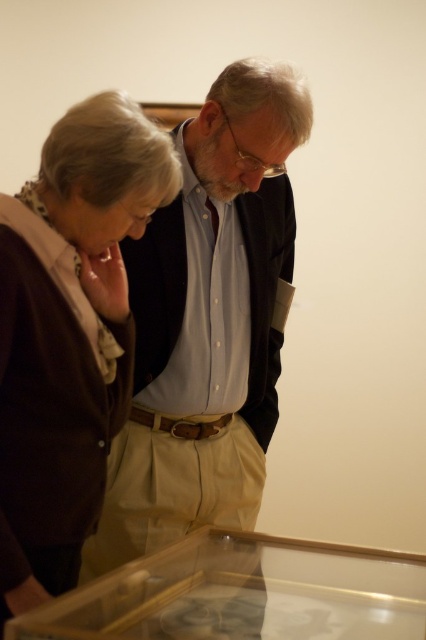
Which is behind, point (178, 497) or point (97, 145)?

Point (178, 497)

Where is `light blue button-down shirt at center`? This screenshot has height=640, width=426. light blue button-down shirt at center is located at coordinates (207, 323).

Does point (192, 420) come in front of point (63, 296)?

No.

What are the coordinates of `light blue button-down shirt at center` in the screenshot? It's located at (207, 323).

Does light blue button-down shirt at center appear over transparent glass case at lower center?

Indeed, light blue button-down shirt at center is positioned over transparent glass case at lower center.

Who is more forward, (268,314) or (43,609)?

Point (43,609) is in front.

Which is in front, point (169, 273) or point (111, 627)?

Point (111, 627) is more forward.

Where is `light blue button-down shirt at center`? light blue button-down shirt at center is located at coordinates (207, 323).

Who is lower down, brown cardigan at left or transparent glass case at lower center?

Positioned lower is transparent glass case at lower center.

Is point (86, 244) positioned behind point (199, 636)?

Yes.

Identify the location of brown cardigan at left. Image resolution: width=426 pixels, height=640 pixels. (69, 333).

Find the location of a particular element. brown cardigan at left is located at coordinates (69, 333).